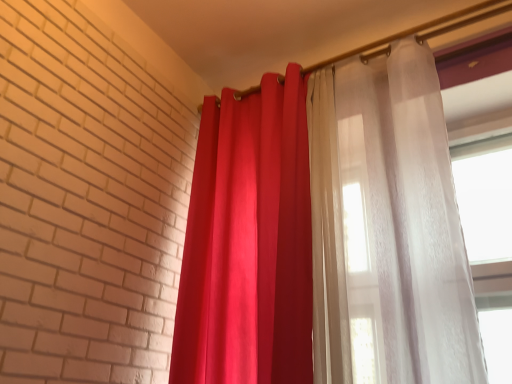
The image size is (512, 384). What do you see at coordinates (248, 243) in the screenshot?
I see `matte red curtain at center, acting as the 2th curtain starting from the right` at bounding box center [248, 243].

Find the location of `matte red curtain at center, which is counted as the first curtain, starting from the left`. matte red curtain at center, which is counted as the first curtain, starting from the left is located at coordinates (248, 243).

This screenshot has height=384, width=512. What do you see at coordinates (323, 231) in the screenshot? I see `sheer white curtain at right, which appears as the 2th curtain when viewed from the left` at bounding box center [323, 231].

How much space does sheer white curtain at right, which appears as the 2th curtain when viewed from the left, occupy horizontally?

The width of sheer white curtain at right, which appears as the 2th curtain when viewed from the left, is 10.10 inches.

Locate an element on the screen. sheer white curtain at right, which appears as the 2th curtain when viewed from the left is located at coordinates (323, 231).

I want to click on matte red curtain at center, acting as the 2th curtain starting from the right, so click(248, 243).

Is sheer white curtain at right, which appears as the 2th curtain when viewed from the left, to the right of matte red curtain at center, which is counted as the first curtain, starting from the left, from the viewer's perspective?

Correct, you'll find sheer white curtain at right, which appears as the 2th curtain when viewed from the left, to the right of matte red curtain at center, which is counted as the first curtain, starting from the left.

Relative to matte red curtain at center, which is counted as the first curtain, starting from the left, is sheer white curtain at right, which is the first curtain in right-to-left order, in front or behind?

Visually, sheer white curtain at right, which is the first curtain in right-to-left order, is located in front of matte red curtain at center, which is counted as the first curtain, starting from the left.

Between point (397, 110) and point (243, 342), which one is positioned in front?

The point (243, 342) is closer to the camera.

From the image's perspective, which one is positioned higher, sheer white curtain at right, which appears as the 2th curtain when viewed from the left, or matte red curtain at center, acting as the 2th curtain starting from the right?

From the image's view, sheer white curtain at right, which appears as the 2th curtain when viewed from the left, is above.

From a real-world perspective, is sheer white curtain at right, which appears as the 2th curtain when viewed from the left, on matte red curtain at center, which is counted as the first curtain, starting from the left?

Yes, from a real-world perspective, sheer white curtain at right, which appears as the 2th curtain when viewed from the left, is above matte red curtain at center, which is counted as the first curtain, starting from the left.

Considering the relative sizes of sheer white curtain at right, which is the first curtain in right-to-left order, and matte red curtain at center, acting as the 2th curtain starting from the right, in the image provided, is sheer white curtain at right, which is the first curtain in right-to-left order, wider than matte red curtain at center, acting as the 2th curtain starting from the right,?

Incorrect, the width of sheer white curtain at right, which is the first curtain in right-to-left order, does not surpass that of matte red curtain at center, acting as the 2th curtain starting from the right.

Does sheer white curtain at right, which is the first curtain in right-to-left order, have a lesser height compared to matte red curtain at center, acting as the 2th curtain starting from the right?

Correct, sheer white curtain at right, which is the first curtain in right-to-left order, is not as tall as matte red curtain at center, acting as the 2th curtain starting from the right.

Consider the image. Considering the sizes of sheer white curtain at right, which appears as the 2th curtain when viewed from the left, and matte red curtain at center, acting as the 2th curtain starting from the right, in the image, is sheer white curtain at right, which appears as the 2th curtain when viewed from the left, bigger or smaller than matte red curtain at center, acting as the 2th curtain starting from the right,?

Clearly, sheer white curtain at right, which appears as the 2th curtain when viewed from the left, is smaller in size than matte red curtain at center, acting as the 2th curtain starting from the right.

Is sheer white curtain at right, which appears as the 2th curtain when viewed from the left, located outside matte red curtain at center, which is counted as the first curtain, starting from the left?

That's correct, sheer white curtain at right, which appears as the 2th curtain when viewed from the left, is outside of matte red curtain at center, which is counted as the first curtain, starting from the left.

From the picture: Are sheer white curtain at right, which appears as the 2th curtain when viewed from the left, and matte red curtain at center, acting as the 2th curtain starting from the right, making contact?

sheer white curtain at right, which appears as the 2th curtain when viewed from the left, and matte red curtain at center, acting as the 2th curtain starting from the right, are not in contact.

Is sheer white curtain at right, which appears as the 2th curtain when viewed from the left, looking in the opposite direction of matte red curtain at center, which is counted as the first curtain, starting from the left?

No.

Consider the image. What's the angular difference between sheer white curtain at right, which is the first curtain in right-to-left order, and matte red curtain at center, acting as the 2th curtain starting from the right,'s facing directions?

The angle between the facing direction of sheer white curtain at right, which is the first curtain in right-to-left order, and the facing direction of matte red curtain at center, acting as the 2th curtain starting from the right, is 2.3 degrees.

From the picture: How far apart are sheer white curtain at right, which appears as the 2th curtain when viewed from the left, and matte red curtain at center, which is counted as the first curtain, starting from the left?

The distance of sheer white curtain at right, which appears as the 2th curtain when viewed from the left, from matte red curtain at center, which is counted as the first curtain, starting from the left, is 4.09 inches.

Locate an element on the screen. This screenshot has width=512, height=384. curtain in front of the matte red curtain at center, acting as the 2th curtain starting from the right is located at coordinates (323, 231).

Would you say matte red curtain at center, which is counted as the first curtain, starting from the left, is to the left or to the right of sheer white curtain at right, which is the first curtain in right-to-left order, in the picture?

From the image, it's evident that matte red curtain at center, which is counted as the first curtain, starting from the left, is to the left of sheer white curtain at right, which is the first curtain in right-to-left order.

Is matte red curtain at center, which is counted as the first curtain, starting from the left, positioned behind sheer white curtain at right, which appears as the 2th curtain when viewed from the left?

Yes.

Does point (255, 262) appear closer or farther from the camera than point (338, 326)?

Point (255, 262) is positioned farther from the camera compared to point (338, 326).

From the image's perspective, is matte red curtain at center, acting as the 2th curtain starting from the right, located above or below sheer white curtain at right, which is the first curtain in right-to-left order?

From the image's perspective, matte red curtain at center, acting as the 2th curtain starting from the right, appears below sheer white curtain at right, which is the first curtain in right-to-left order.

From a real-world perspective, is matte red curtain at center, which is counted as the first curtain, starting from the left, physically below sheer white curtain at right, which is the first curtain in right-to-left order?

Yes, from a real-world perspective, matte red curtain at center, which is counted as the first curtain, starting from the left, is below sheer white curtain at right, which is the first curtain in right-to-left order.

In the scene shown: Which object is wider, matte red curtain at center, acting as the 2th curtain starting from the right, or sheer white curtain at right, which appears as the 2th curtain when viewed from the left?

With larger width is matte red curtain at center, acting as the 2th curtain starting from the right.

Can you confirm if matte red curtain at center, which is counted as the first curtain, starting from the left, is shorter than sheer white curtain at right, which is the first curtain in right-to-left order?

No.

Between matte red curtain at center, acting as the 2th curtain starting from the right, and sheer white curtain at right, which is the first curtain in right-to-left order, which one has larger size?

With larger size is matte red curtain at center, acting as the 2th curtain starting from the right.

Is matte red curtain at center, which is counted as the first curtain, starting from the left, positioned beyond the bounds of sheer white curtain at right, which is the first curtain in right-to-left order?

Indeed, matte red curtain at center, which is counted as the first curtain, starting from the left, is completely outside sheer white curtain at right, which is the first curtain in right-to-left order.

Is matte red curtain at center, acting as the 2th curtain starting from the right, not close to sheer white curtain at right, which appears as the 2th curtain when viewed from the left?

They are positioned close to each other.

Is matte red curtain at center, acting as the 2th curtain starting from the right, turned away from sheer white curtain at right, which is the first curtain in right-to-left order?

No, sheer white curtain at right, which is the first curtain in right-to-left order, is not at the back of matte red curtain at center, acting as the 2th curtain starting from the right.

How different are the orientations of matte red curtain at center, acting as the 2th curtain starting from the right, and sheer white curtain at right, which appears as the 2th curtain when viewed from the left, in degrees?

They differ by 2.3 degrees in their facing directions.

How much distance is there between matte red curtain at center, acting as the 2th curtain starting from the right, and sheer white curtain at right, which is the first curtain in right-to-left order?

matte red curtain at center, acting as the 2th curtain starting from the right, and sheer white curtain at right, which is the first curtain in right-to-left order, are 4.09 inches apart from each other.

The height and width of the screenshot is (384, 512). Identify the location of curtain behind the sheer white curtain at right, which appears as the 2th curtain when viewed from the left. (248, 243).

Locate an element on the screen. Image resolution: width=512 pixels, height=384 pixels. curtain on the left of sheer white curtain at right, which appears as the 2th curtain when viewed from the left is located at coordinates (248, 243).

The height and width of the screenshot is (384, 512). Find the location of `curtain in front of the matte red curtain at center, acting as the 2th curtain starting from the right`. curtain in front of the matte red curtain at center, acting as the 2th curtain starting from the right is located at coordinates (323, 231).